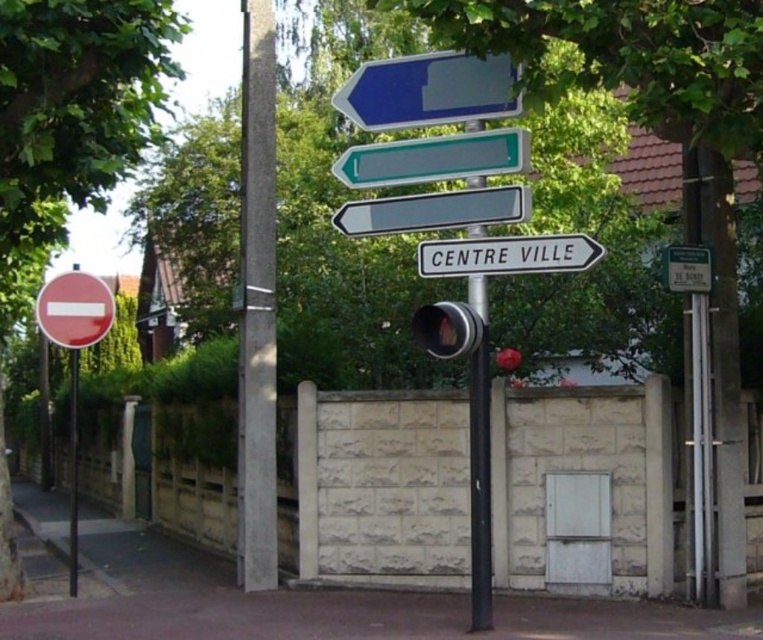
Who is positioned more to the right, black plastic sign at center or white plastic sign at center?

white plastic sign at center is more to the right.

Who is positioned more to the left, black plastic sign at center or white plastic sign at center?

From the viewer's perspective, black plastic sign at center appears more on the left side.

Who is more forward, [388,230] or [559,266]?

Positioned in front is point [559,266].

Locate an element on the screen. black plastic sign at center is located at coordinates (433, 211).

Is point (465, 99) more distant than point (359, 220)?

No, (465, 99) is closer to viewer.

Can you confirm if blue glossy sign at upper center is positioned to the left of black plastic sign at center?

Yes, blue glossy sign at upper center is to the left of black plastic sign at center.

Where is `blue glossy sign at upper center`? blue glossy sign at upper center is located at coordinates (427, 90).

The height and width of the screenshot is (640, 763). I want to click on blue glossy sign at upper center, so click(x=427, y=90).

Is concrete pole at center taller than black metal pole at center?

Yes.

Can you confirm if concrete pole at center is positioned to the left of black metal pole at center?

Indeed, concrete pole at center is positioned on the left side of black metal pole at center.

Which is in front, point (248, 292) or point (478, 465)?

Positioned in front is point (478, 465).

Image resolution: width=763 pixels, height=640 pixels. In order to click on concrete pole at center in this screenshot , I will do `click(256, 305)`.